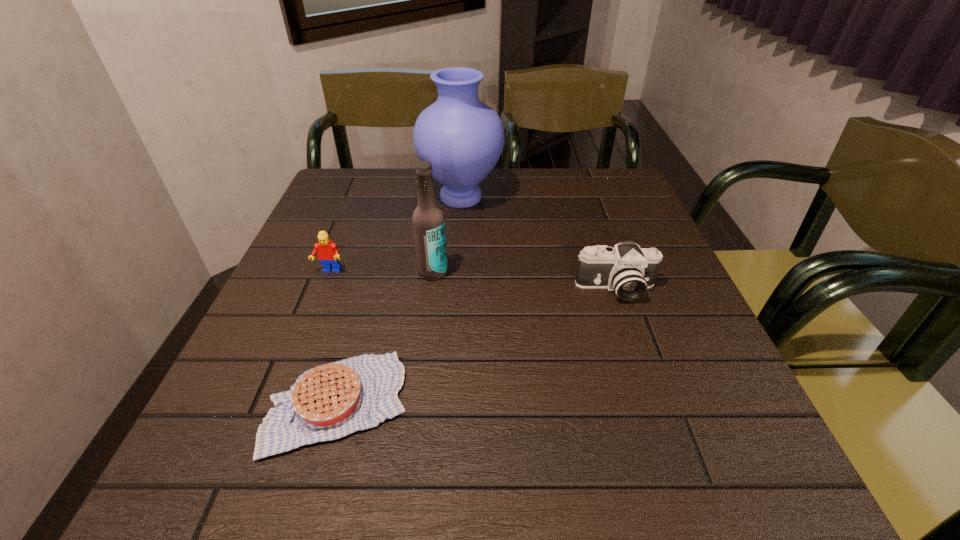
This screenshot has width=960, height=540. I want to click on free region located on the front-facing side of the Lego, so click(291, 369).

Locate an element on the screen. The height and width of the screenshot is (540, 960). vacant area located 0.140m on the right of the nearest object is located at coordinates (492, 403).

This screenshot has height=540, width=960. Identify the location of object at the far edge. (463, 138).

Identify the location of object that is positioned at the near edge. (330, 401).

At what (x,y) coordinates should I click in order to perform the action: click on Lego present at the left edge. Please return your answer as a coordinate pair (x, y). Image resolution: width=960 pixels, height=540 pixels. Looking at the image, I should click on (328, 253).

At what (x,y) coordinates should I click in order to perform the action: click on pie at the left edge. Please return your answer as a coordinate pair (x, y). The image size is (960, 540). Looking at the image, I should click on (330, 401).

Find the location of `object present at the right edge`. object present at the right edge is located at coordinates (628, 270).

Locate an element on the screen. This screenshot has width=960, height=540. object that is positioned at the near left corner is located at coordinates (330, 401).

Identify the location of vacant space at the far edge of the desktop. The image size is (960, 540). (394, 185).

You are a GUI agent. You are given a task and a screenshot of the screen. Output one action in this format:
    pyautogui.click(x=<x>, y=<y>)
    Task: Click on the vacant space at the near edge of the desktop
    Image resolution: width=960 pixels, height=540 pixels.
    Given the screenshot: What is the action you would take?
    pyautogui.click(x=664, y=480)